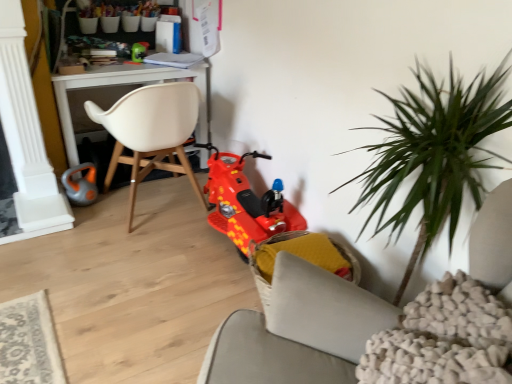
Find the location of a particular element. vacant space in front of white matte chair at center, which is the 2th chair from right to left is located at coordinates (135, 266).